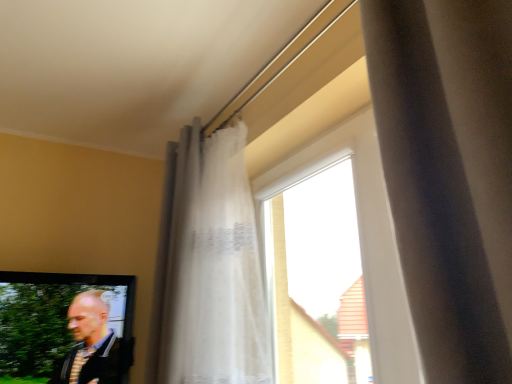
Question: From the image's perspective, is white sheer curtain at upper center above or below transparent glass window at center?

Choices:
 (A) above
 (B) below

Answer: (A)

Question: Is point (215, 311) positioned closer to the camera than point (395, 243)?

Choices:
 (A) closer
 (B) farther

Answer: (B)

Question: Based on their relative distances, which object is farther from the white sheer curtain at upper center?

Choices:
 (A) striped fabric shirt at lower left
 (B) transparent glass window at center

Answer: (A)

Question: Based on their relative distances, which object is nearer to the transparent glass window at center?

Choices:
 (A) white sheer curtain at upper center
 (B) striped fabric shirt at lower left

Answer: (A)